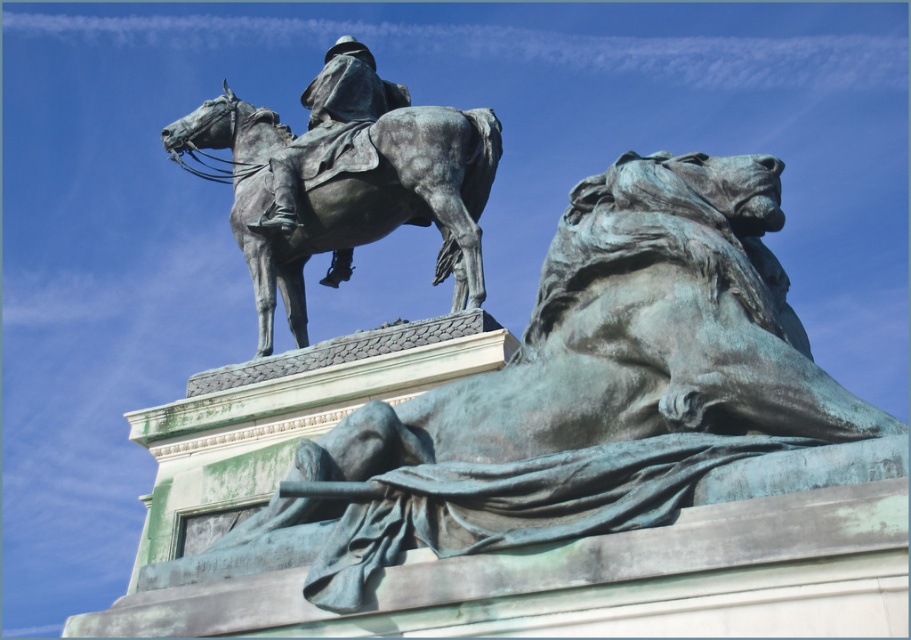
Question: Does bronze/green patina horse at upper center appear over bronze statue at center?

Choices:
 (A) no
 (B) yes

Answer: (B)

Question: Among these objects, which one is nearest to the camera?

Choices:
 (A) bronze statue at center
 (B) bronze/green patina horse at upper center

Answer: (B)

Question: Does bronze/green patina horse at upper center have a lesser width compared to bronze statue at center?

Choices:
 (A) no
 (B) yes

Answer: (A)

Question: Does bronze/green patina horse at upper center have a smaller size compared to bronze statue at center?

Choices:
 (A) no
 (B) yes

Answer: (A)